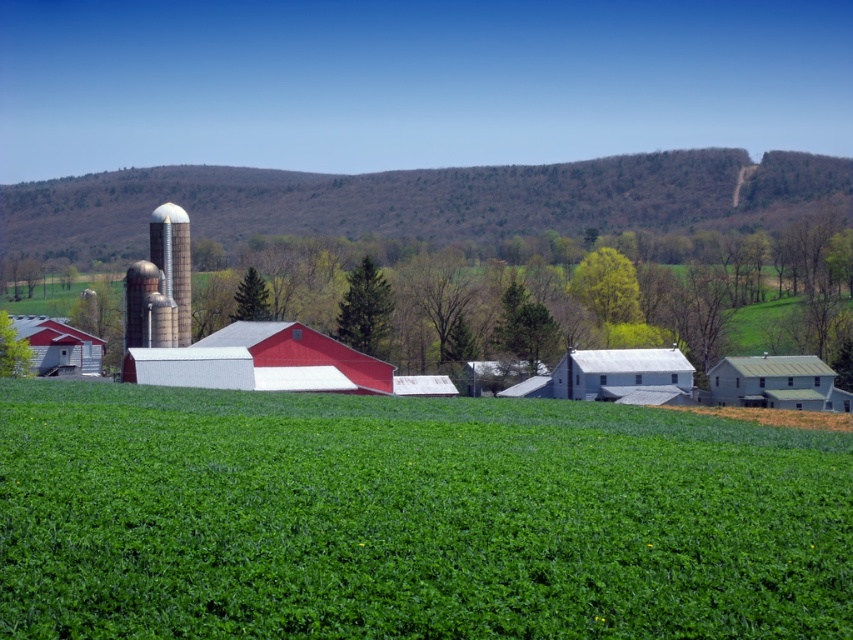
You are standing at the point marked by the coordinate point at (x=260, y=362) in the image. What structure are you directly facing?

The point at (x=260, y=362) marks the matte white barn at center, so you are directly facing the matte white barn at center.

You are a farmer planning to install a new irrigation system. You need to determine the best location to place a water tank so it can supply both the matte white barn at center and the green metal barn at right. Based on their positions, which barn is closer to the water tank if placed centrally between them?

The matte white barn at center is closer to the water tank because it is positioned in front of the green metal barn at right, meaning it is nearer to the central point between them.